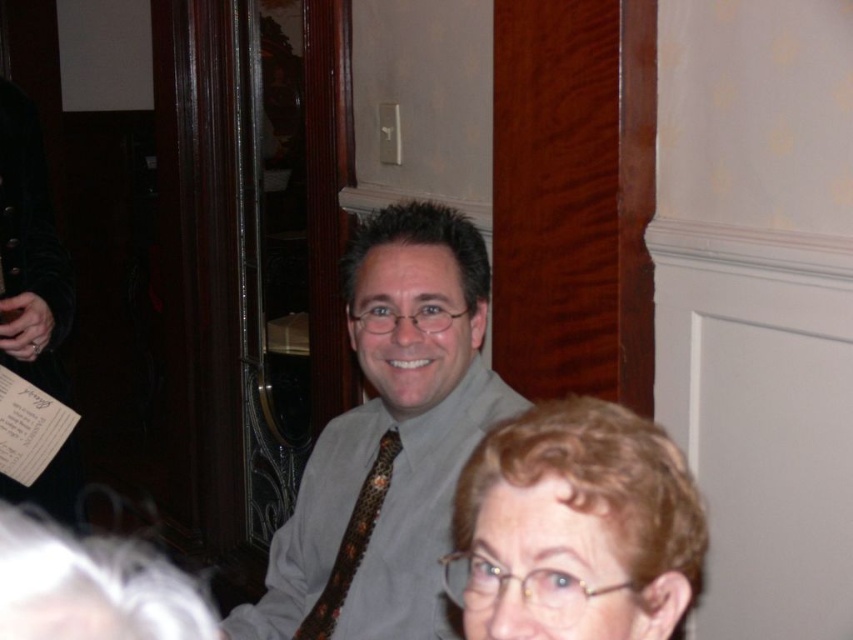
Question: Which point appears closest to the camera in this image?

Choices:
 (A) (462, 436)
 (B) (376, 458)
 (C) (593, 534)

Answer: (C)

Question: Can you confirm if matte gray shirt at center is wider than light brown hair at lower right?

Choices:
 (A) no
 (B) yes

Answer: (B)

Question: Can you confirm if matte gray shirt at center is positioned to the left of light brown hair at lower right?

Choices:
 (A) yes
 (B) no

Answer: (A)

Question: Among these objects, which one is farthest from the camera?

Choices:
 (A) light brown hair at lower right
 (B) matte gray shirt at center

Answer: (B)

Question: Does matte gray shirt at center appear on the right side of leopard print tie at center?

Choices:
 (A) no
 (B) yes

Answer: (B)

Question: Which object appears farthest from the camera in this image?

Choices:
 (A) light brown hair at lower right
 (B) leopard print tie at center

Answer: (B)